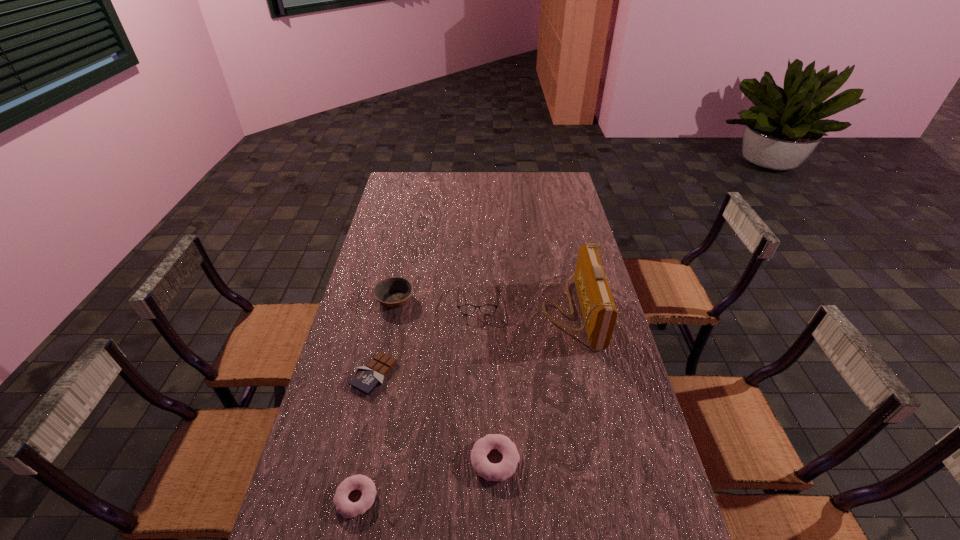
At what (x,y) coordinates should I click in order to perform the action: click on the shorter doughnut. Please return your answer as a coordinate pair (x, y). The width and height of the screenshot is (960, 540). Looking at the image, I should click on (348, 509).

The width and height of the screenshot is (960, 540). What are the coordinates of `the third shortest object` in the screenshot? It's located at (505, 469).

Identify the location of the right doughnut. (505, 469).

Identify the location of bowl. (393, 292).

Where is `spectacles`? spectacles is located at coordinates (466, 309).

You are a GUI agent. You are given a task and a screenshot of the screen. Output one action in this format:
    pyautogui.click(x=<x>, y=<y>)
    Task: Click on the chocolate bar
    Image resolution: width=960 pixels, height=540 pixels.
    Given the screenshot: What is the action you would take?
    pyautogui.click(x=367, y=378)

Where is `the tallest object`? The width and height of the screenshot is (960, 540). the tallest object is located at coordinates (599, 312).

Find the location of a particular element. The image size is (960, 540). the rightmost object is located at coordinates (599, 312).

Where is `blank space located 0.330m on the right of the left doughnut`? The height and width of the screenshot is (540, 960). blank space located 0.330m on the right of the left doughnut is located at coordinates (515, 498).

Image resolution: width=960 pixels, height=540 pixels. I want to click on blank space located on the front of the fourth tallest object, so click(x=496, y=505).